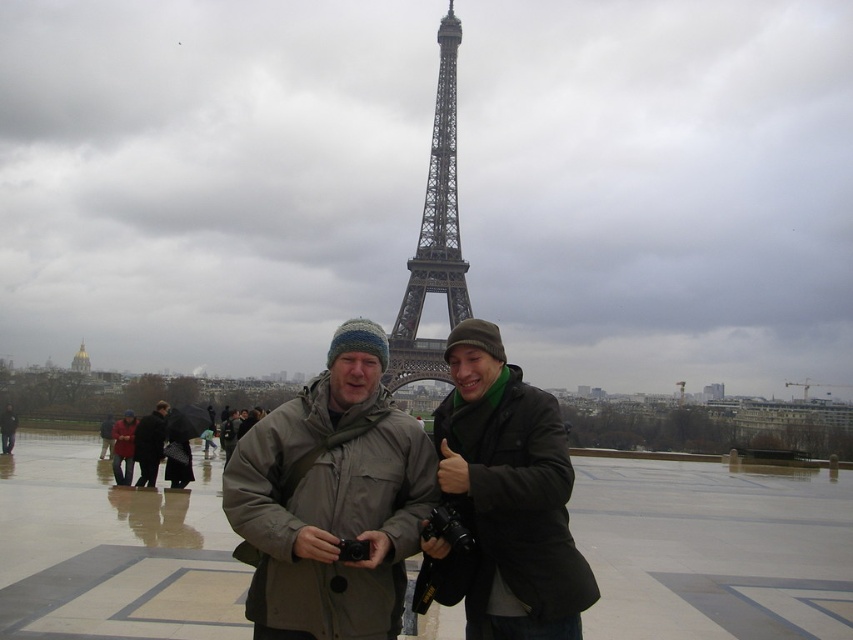
You are a photographer at the Trocadero Gardens in Paris, and you want to capture both the dark brown leather coat at lower left and the red wool coat at center in your shot. Which coat should you focus on first to ensure both are in frame?

You should focus on the dark brown leather coat at lower left first because it is closer to the viewer, so adjusting the camera to include it will naturally bring the red wool coat at center into the frame as well.

You are a photographer trying to capture a photo of both the dark green matte jacket at center and the red wool coat at center in the Trocadadero Gardens. Since you want both subjects to be fully visible in the frame, which one should you focus on first to ensure they are both in focus?

You should focus on the dark green matte jacket at center first because it is much taller than the red wool coat at center, so adjusting focus starting from the taller subject ensures both are in focus.

You are a photographer at the Trocadero Gardens in Paris, and you want to take a photo of the Eiffel Tower. You have two coats in the foreground, a dark brown leather coat at lower left and a red wool coat at center. Which coat is taller and might block the view of the Eiffel Tower if placed closer?

The dark brown leather coat at lower left is taller than the red wool coat at center, so it might block the view of the Eiffel Tower more if placed closer.